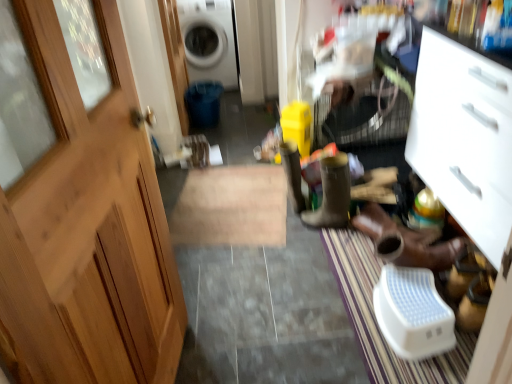
What do you see at coordinates (293, 174) in the screenshot? I see `yellow rubber boot at center` at bounding box center [293, 174].

Find the location of `white textured doormat at lower right`. white textured doormat at lower right is located at coordinates (376, 321).

Where is `wooden door at left`? This screenshot has height=384, width=512. wooden door at left is located at coordinates click(80, 206).

At what (x,y) coordinates should I click in order to perform the action: click on white glossy washing machine at upper center. Please return your answer as a coordinate pair (x, y). Looking at the image, I should click on (209, 41).

Where is `yellow rubber boot at center`? This screenshot has width=512, height=384. yellow rubber boot at center is located at coordinates (293, 174).

Considering the relative positions of brown leather shoes at lower right, the 2th footwear viewed from the left, and white textured doormat at lower right in the image provided, is brown leather shoes at lower right, the 2th footwear viewed from the left, to the right of white textured doormat at lower right from the viewer's perspective?

Yes.

Is brown leather shoes at lower right, the 1th footwear in the right-to-left sequence, positioned before white textured doormat at lower right?

No, brown leather shoes at lower right, the 1th footwear in the right-to-left sequence, is further to the viewer.

Is point (431, 249) farther from camera compared to point (352, 283)?

No, it is in front of (352, 283).

From a real-world perspective, which is physically above, brown leather shoes at lower right, the 2th footwear viewed from the left, or white textured doormat at lower right?

From a 3D spatial view, brown leather shoes at lower right, the 2th footwear viewed from the left, is above.

Which object is wider, brown leather boot at center, which is counted as the second footwear, starting from the right, or yellow rubber boot at center?

yellow rubber boot at center.

Between brown leather boot at center, which is counted as the second footwear, starting from the right, and yellow rubber boot at center, which one appears on the left side from the viewer's perspective?

yellow rubber boot at center is more to the left.

How much distance is there between brown leather boot at center, which is counted as the second footwear, starting from the right, and yellow rubber boot at center?

They are 7.52 inches apart.

From the image's perspective, is brown leather boot at center, which is counted as the second footwear, starting from the right, below yellow rubber boot at center?

Yes, from the image's perspective, brown leather boot at center, which is counted as the second footwear, starting from the right, is below yellow rubber boot at center.

Is yellow rubber boot at center closer to camera compared to brown leather shoes at lower right, the 1th footwear in the right-to-left sequence?

No, the depth of yellow rubber boot at center is greater than that of brown leather shoes at lower right, the 1th footwear in the right-to-left sequence.

Is brown leather shoes at lower right, the 2th footwear viewed from the left, a part of yellow rubber boot at center?

No, brown leather shoes at lower right, the 2th footwear viewed from the left, is not inside yellow rubber boot at center.

From the image's perspective, which is above, yellow rubber boot at center or brown leather shoes at lower right, the 2th footwear viewed from the left?

yellow rubber boot at center.

Which of these two, yellow rubber boot at center or brown leather shoes at lower right, the 1th footwear in the right-to-left sequence, is wider?

yellow rubber boot at center is wider.

From the picture: Looking at their sizes, would you say white textured doormat at lower right is wider or thinner than white glossy washing machine at upper center?

In the image, white textured doormat at lower right appears to be more narrow than white glossy washing machine at upper center.

Identify the location of doormat below the white glossy washing machine at upper center (from a real-world perspective). The image size is (512, 384). (376, 321).

Which is closer to the camera, (428, 361) or (189, 49)?

The point (428, 361) is closer to the camera.

What's the angular difference between white textured doormat at lower right and white glossy washing machine at upper center's facing directions?

90.1 degrees separate the facing orientations of white textured doormat at lower right and white glossy washing machine at upper center.

Is white glossy washing machine at upper center touching yellow rubber boot at center?

There is a gap between white glossy washing machine at upper center and yellow rubber boot at center.

Is white glossy washing machine at upper center facing away from yellow rubber boot at center?

No, yellow rubber boot at center is not at the back of white glossy washing machine at upper center.

Would you say white glossy washing machine at upper center is outside yellow rubber boot at center?

Absolutely, white glossy washing machine at upper center is external to yellow rubber boot at center.

Based on the photo, is the depth of brown leather boot at center, which is counted as the second footwear, starting from the right, less than that of wooden door at left?

No, brown leather boot at center, which is counted as the second footwear, starting from the right, is further to the viewer.

Where is `the 1st footwear below the wooden door at left (from a real-world perspective)`? the 1st footwear below the wooden door at left (from a real-world perspective) is located at coordinates (331, 195).

From the image's perspective, is brown leather boot at center, arranged as the 1th footwear when viewed from the left, below wooden door at left?

No, from the image's perspective, brown leather boot at center, arranged as the 1th footwear when viewed from the left, is not below wooden door at left.

Is brown leather boot at center, which is counted as the second footwear, starting from the right, thinner than wooden door at left?

No.

What's the angular difference between white matte cabinet at right and yellow rubber boot at center's facing directions?

The angular difference between white matte cabinet at right and yellow rubber boot at center is 87.2 degrees.

Which object is closer to the camera taking this photo, white matte cabinet at right or yellow rubber boot at center?

white matte cabinet at right is closer to the camera.

Is white matte cabinet at right not inside yellow rubber boot at center?

white matte cabinet at right lies outside yellow rubber boot at center's area.

Locate an element on the screen. footwear that is the 1st object above the white textured doormat at lower right (from a real-world perspective) is located at coordinates (409, 241).

Find the location of a particular element. The width and height of the screenshot is (512, 384). the 1st footwear in front of the yellow rubber boot at center, starting your count from the anchor is located at coordinates (331, 195).

Which object lies further to the anchor point white matte cabinet at right, brown leather shoes at lower right, the 1th footwear in the right-to-left sequence, or white textured doormat at lower right?

Based on the image, white textured doormat at lower right appears to be further to white matte cabinet at right.

Looking at the image, which one is located closer to wooden door at left, brown leather shoes at lower right, the 1th footwear in the right-to-left sequence, or white glossy washing machine at upper center?

Based on the image, brown leather shoes at lower right, the 1th footwear in the right-to-left sequence, appears to be nearer to wooden door at left.

Which object lies nearer to the anchor point brown leather boot at center, arranged as the 1th footwear when viewed from the left, white textured doormat at lower right or white matte cabinet at right?

white textured doormat at lower right is closer to brown leather boot at center, arranged as the 1th footwear when viewed from the left.

From the picture: Estimate the real-world distances between objects in this image. Which object is closer to wooden door at left, brown leather shoes at lower right, the 1th footwear in the right-to-left sequence, or brown leather boot at center, arranged as the 1th footwear when viewed from the left?

The object closer to wooden door at left is brown leather shoes at lower right, the 1th footwear in the right-to-left sequence.

Consider the image. From the image, which object appears to be nearer to yellow rubber boot at center, brown leather shoes at lower right, the 2th footwear viewed from the left, or white glossy washing machine at upper center?

brown leather shoes at lower right, the 2th footwear viewed from the left.

Looking at the image, which one is located closer to brown leather boot at center, which is counted as the second footwear, starting from the right, white matte cabinet at right or wooden door at left?

The object closer to brown leather boot at center, which is counted as the second footwear, starting from the right, is white matte cabinet at right.

Estimate the real-world distances between objects in this image. Which object is closer to white matte cabinet at right, white glossy washing machine at upper center or white textured doormat at lower right?

Based on the image, white textured doormat at lower right appears to be nearer to white matte cabinet at right.

Estimate the real-world distances between objects in this image. Which object is further from white matte cabinet at right, brown leather boot at center, which is counted as the second footwear, starting from the right, or white textured doormat at lower right?

white textured doormat at lower right is further to white matte cabinet at right.

I want to click on footwear positioned between brown leather shoes at lower right, the 2th footwear viewed from the left, and white glossy washing machine at upper center from near to far, so click(331, 195).

Image resolution: width=512 pixels, height=384 pixels. In order to click on boot positioned between brown leather boot at center, which is counted as the second footwear, starting from the right, and white glossy washing machine at upper center from near to far in this screenshot , I will do `click(293, 174)`.

At what (x,y) coordinates should I click in order to perform the action: click on boot between brown leather shoes at lower right, the 2th footwear viewed from the left, and white glossy washing machine at upper center, along the z-axis. Please return your answer as a coordinate pair (x, y). The image size is (512, 384). Looking at the image, I should click on (293, 174).

The width and height of the screenshot is (512, 384). I want to click on cabinetry between wooden door at left and yellow rubber boot at center in the front-back direction, so click(465, 137).